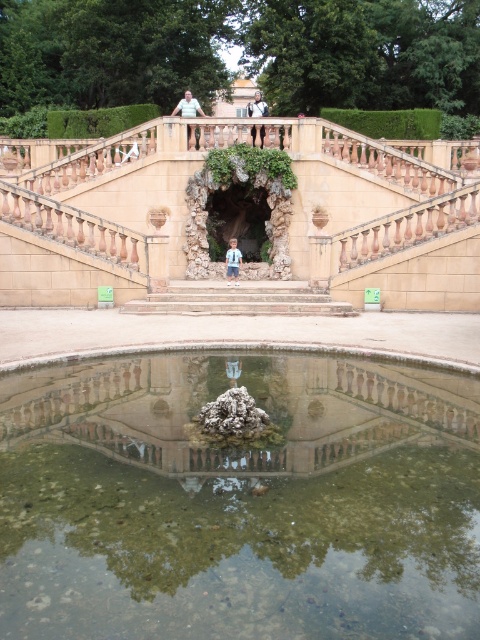
You are standing at the entrance of the grand staircase and want to walk towards the fountain. Based on the image, which direction should you move relative to the stone steps at center?

The stone steps at center are located at point (240, 300) in the image, so you should move towards them to reach the fountain.

You are a photographer standing in front of the fountain and want to capture both the matte blue shirt at upper center and the blue denim shorts at center in the same frame. Based on their positions, which object should you adjust your camera to focus on first to ensure both are in the shot?

The matte blue shirt at upper center should be focused on first since it is positioned to the left of the blue denim shorts at center, allowing the photographer to frame both by centering the shot between them.